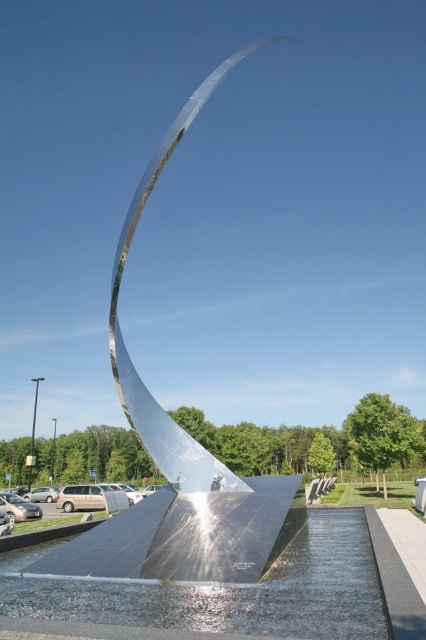
Question: Is polished metallic sculpture at center above clear glass water at center?

Choices:
 (A) yes
 (B) no

Answer: (A)

Question: Which point appears closest to the camera in this image?

Choices:
 (A) (256, 490)
 (B) (301, 632)

Answer: (B)

Question: Can you confirm if polished metallic sculpture at center is positioned to the right of clear glass water at center?

Choices:
 (A) yes
 (B) no

Answer: (B)

Question: Is polished metallic sculpture at center further to camera compared to clear glass water at center?

Choices:
 (A) no
 (B) yes

Answer: (B)

Question: Which point is closer to the camera taking this photo?

Choices:
 (A) (135, 400)
 (B) (317, 515)

Answer: (A)